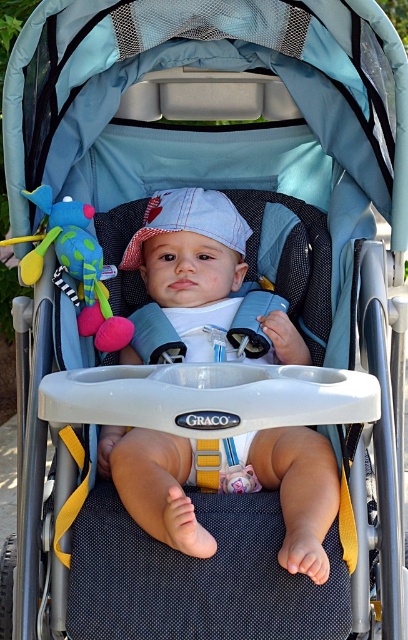
Does point (179, 448) come in front of point (64, 232)?

That is True.

Does point (223, 467) lie behind point (30, 269)?

No, (223, 467) is closer to viewer.

You are a GUI agent. You are given a task and a screenshot of the screen. Output one action in this format:
    pyautogui.click(x=<x>, y=<y>)
    Task: Click on the white cotton hat at center
    The width and height of the screenshot is (408, 640).
    Given the screenshot: What is the action you would take?
    pyautogui.click(x=192, y=260)